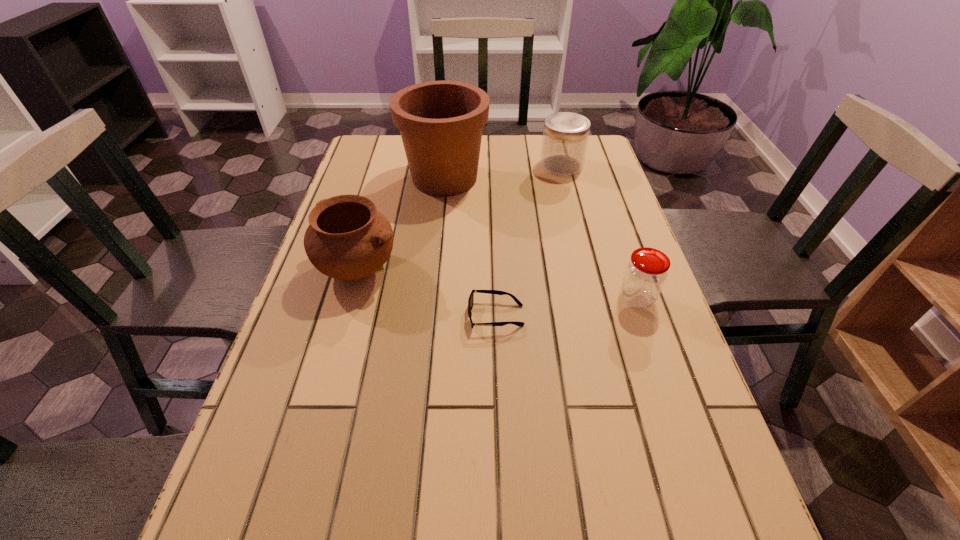
Identify the location of vacant space located 0.190m on the front-facing side of the shortest object. (380, 315).

Where is `vacant space located on the front-facing side of the shortest object`? vacant space located on the front-facing side of the shortest object is located at coordinates (418, 315).

What are the coordinates of `vacant space located on the front-facing side of the shortest object` in the screenshot? It's located at (339, 315).

You are a GUI agent. You are given a task and a screenshot of the screen. Output one action in this format:
    pyautogui.click(x=<x>, y=<y>)
    Task: Click on the flowerpot present at the far edge
    
    Given the screenshot: What is the action you would take?
    pyautogui.click(x=441, y=122)

I want to click on jar that is at the far edge, so click(565, 137).

The image size is (960, 540). Find the location of `flowerpot that is positioned at the left edge`. flowerpot that is positioned at the left edge is located at coordinates click(x=441, y=122).

Where is `pottery at the left edge`? This screenshot has width=960, height=540. pottery at the left edge is located at coordinates (347, 238).

This screenshot has height=540, width=960. Identify the location of object present at the far left corner. (441, 122).

Locate an element on the screen. This screenshot has height=540, width=960. object at the far right corner is located at coordinates (565, 137).

This screenshot has height=540, width=960. What are the coordinates of `vacant area at the far edge of the desktop` in the screenshot? It's located at (497, 161).